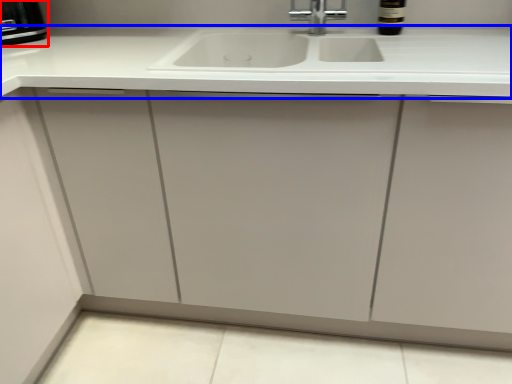
Question: Which object is further to the camera taking this photo, appliance (highlighted by a red box) or countertop (highlighted by a blue box)?

Choices:
 (A) appliance
 (B) countertop

Answer: (A)